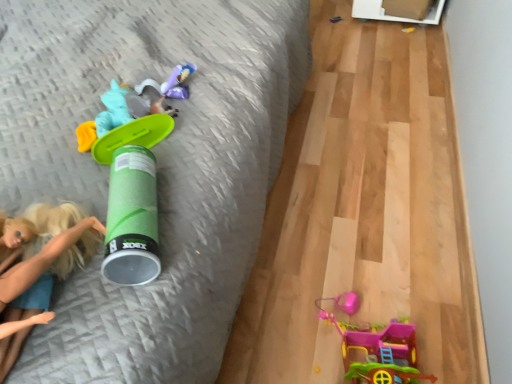
The width and height of the screenshot is (512, 384). What are the coordinates of `vacant area to the left of plastic pink toy house at lower right, the 2th toy in the front-to-back sequence` in the screenshot? It's located at (275, 333).